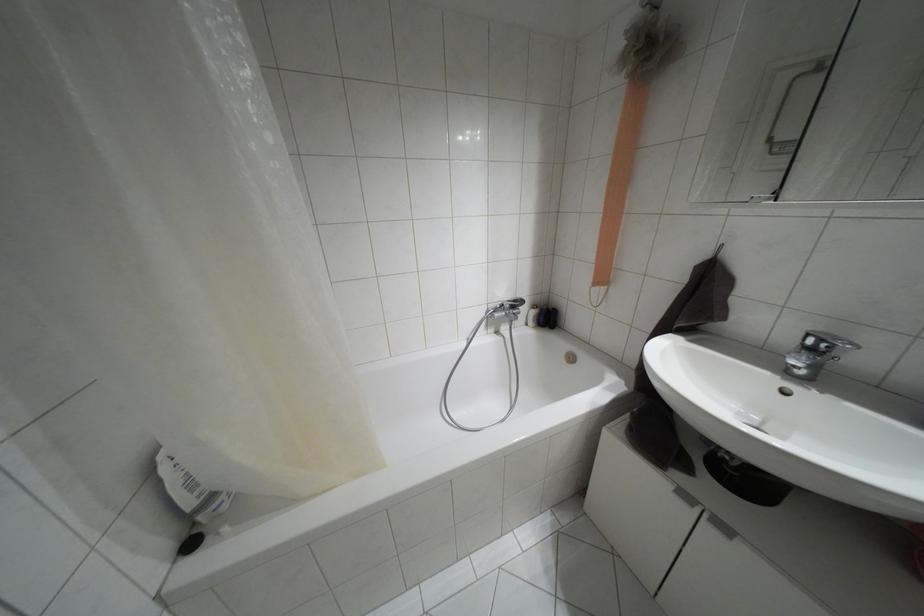
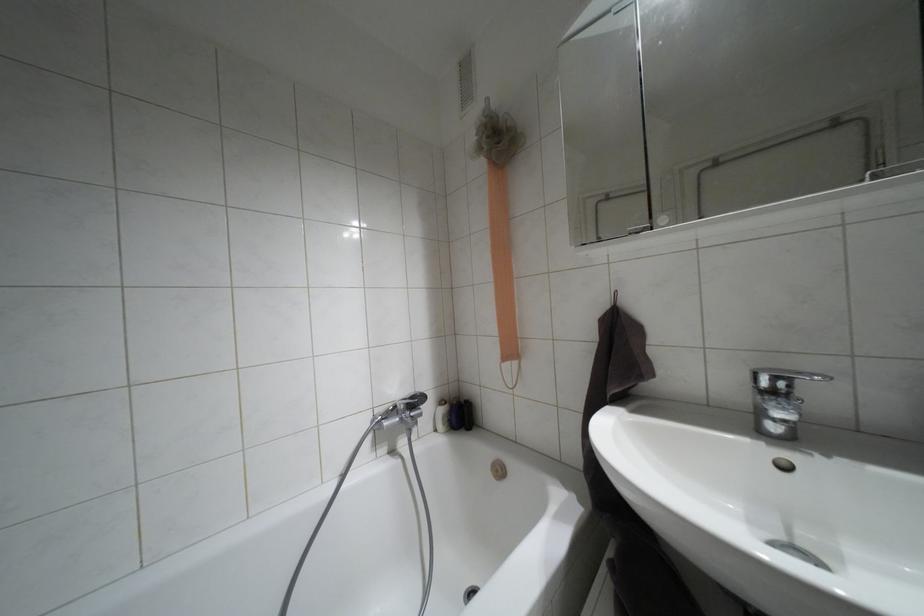
In the scene shown: The images are taken continuously from a first-person perspective. In which direction is your viewpoint rotating?

The camera's rotation is toward right-up.